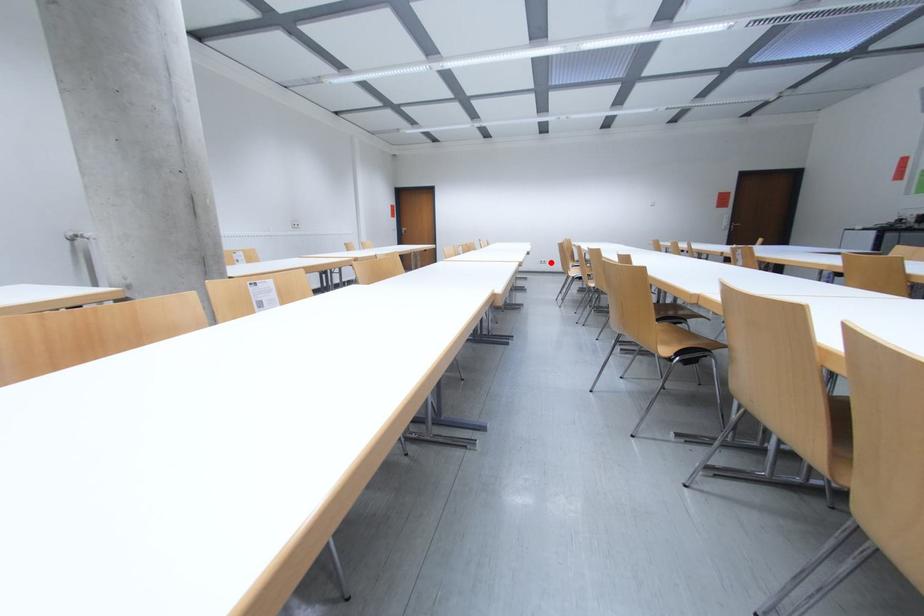
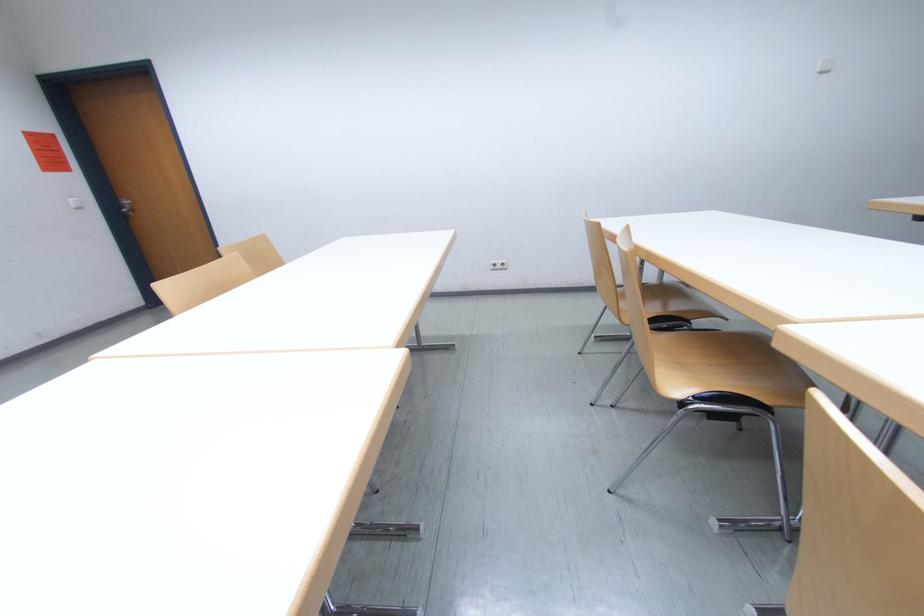
Question: I am providing you with two images of the same scene from different viewpoints. In image1, a red point is highlighted. Considering the same 3D point in image2, which of the following is correct?

Choices:
 (A) It is closer
 (B) It is farther

Answer: (B)